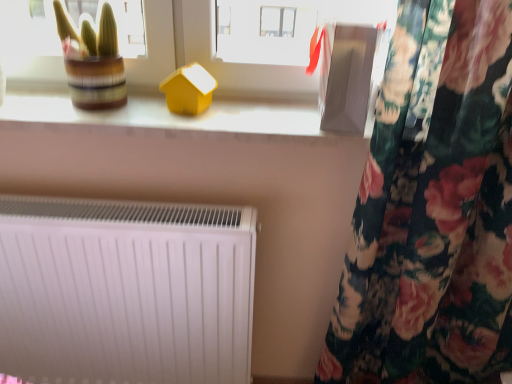
Question: Is the surface of white matte radiator at lower left in direct contact with matte yellow house at upper center?

Choices:
 (A) yes
 (B) no

Answer: (B)

Question: Is white matte radiator at lower left oriented towards matte yellow house at upper center?

Choices:
 (A) no
 (B) yes

Answer: (A)

Question: From a real-world perspective, is white matte radiator at lower left on matte yellow house at upper center?

Choices:
 (A) no
 (B) yes

Answer: (A)

Question: Are white matte radiator at lower left and matte yellow house at upper center located far from each other?

Choices:
 (A) yes
 (B) no

Answer: (B)

Question: Is white matte radiator at lower left not inside matte yellow house at upper center?

Choices:
 (A) yes
 (B) no

Answer: (A)

Question: Looking at the image, does green striped pot at upper left seem bigger or smaller compared to white matte radiator at lower left?

Choices:
 (A) big
 (B) small

Answer: (B)

Question: Is green striped pot at upper left in front of or behind white matte radiator at lower left in the image?

Choices:
 (A) behind
 (B) front

Answer: (B)

Question: From a real-world perspective, is green striped pot at upper left physically located above or below white matte radiator at lower left?

Choices:
 (A) above
 (B) below

Answer: (A)

Question: From their relative heights in the image, would you say green striped pot at upper left is taller or shorter than white matte radiator at lower left?

Choices:
 (A) tall
 (B) short

Answer: (B)

Question: Relative to white plastic house at upper center, is white matte radiator at lower left in front or behind?

Choices:
 (A) behind
 (B) front

Answer: (B)

Question: Considering the positions of white matte radiator at lower left and white plastic house at upper center in the image, is white matte radiator at lower left wider or thinner than white plastic house at upper center?

Choices:
 (A) wide
 (B) thin

Answer: (A)

Question: Considering the positions of white matte radiator at lower left and white plastic house at upper center in the image, is white matte radiator at lower left bigger or smaller than white plastic house at upper center?

Choices:
 (A) small
 (B) big

Answer: (B)

Question: From the image's perspective, is white matte radiator at lower left above or below white plastic house at upper center?

Choices:
 (A) above
 (B) below

Answer: (B)

Question: Is matte yellow house at upper center in front of or behind matte yellow house at center in the image?

Choices:
 (A) front
 (B) behind

Answer: (A)

Question: Considering the relative positions of matte yellow house at upper center and matte yellow house at center in the image provided, is matte yellow house at upper center to the left or to the right of matte yellow house at center?

Choices:
 (A) left
 (B) right

Answer: (B)